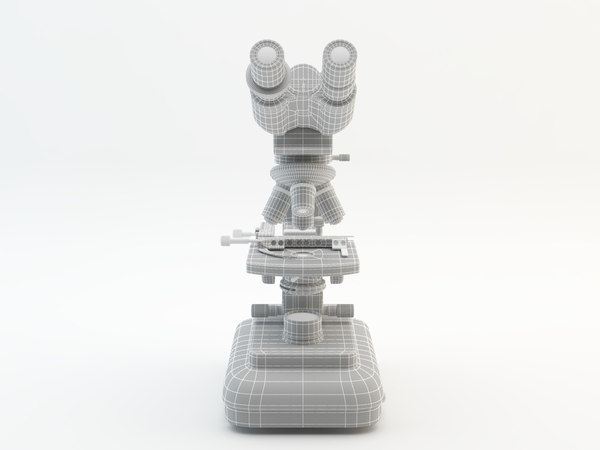
Locate an element on the screen. Image resolution: width=600 pixels, height=450 pixels. slide illuminator is located at coordinates (302, 318).